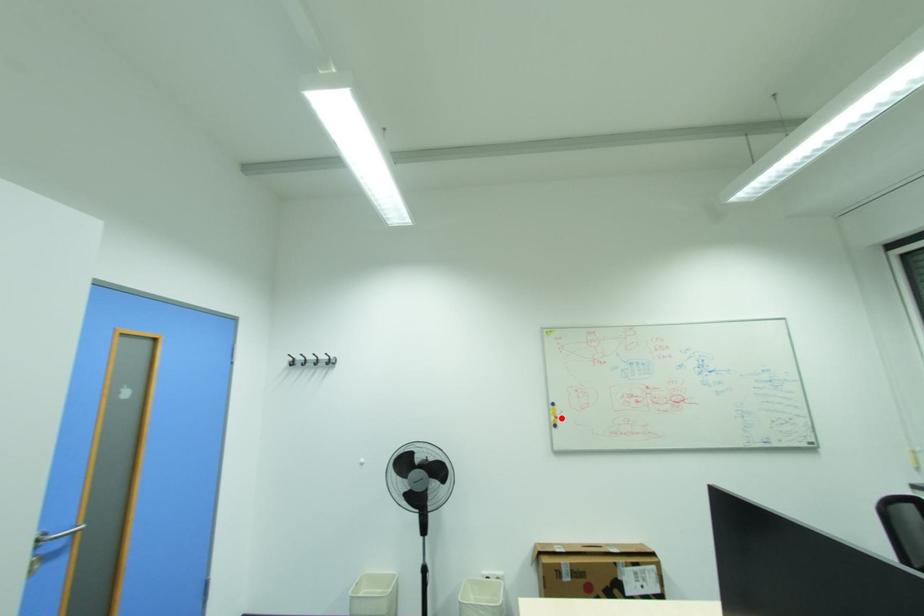
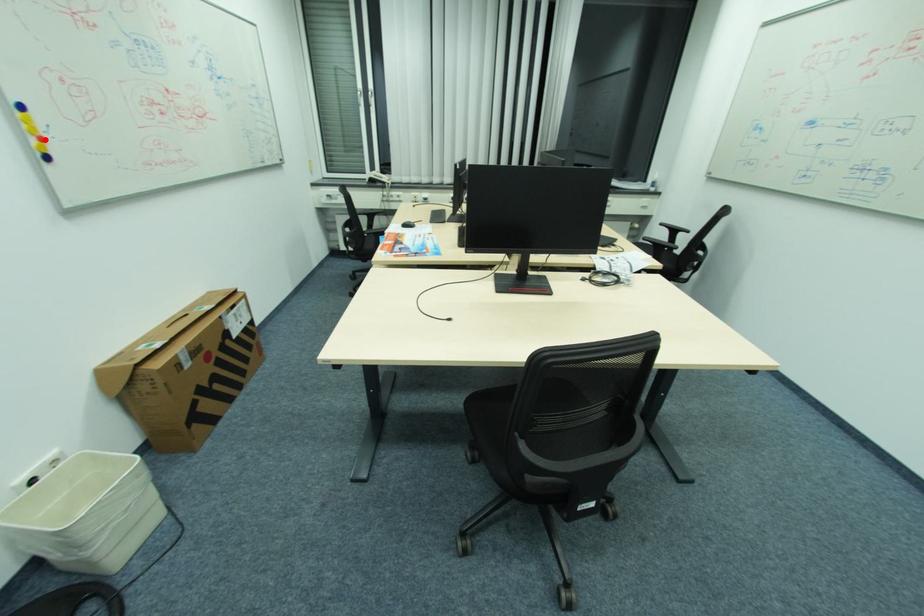
I am providing you with two images of the same scene from different viewpoints. A red point is marked on the first image and another point is marked on the second image. Do the highlighted points in image1 and image2 indicate the same real-world spot?

Yes